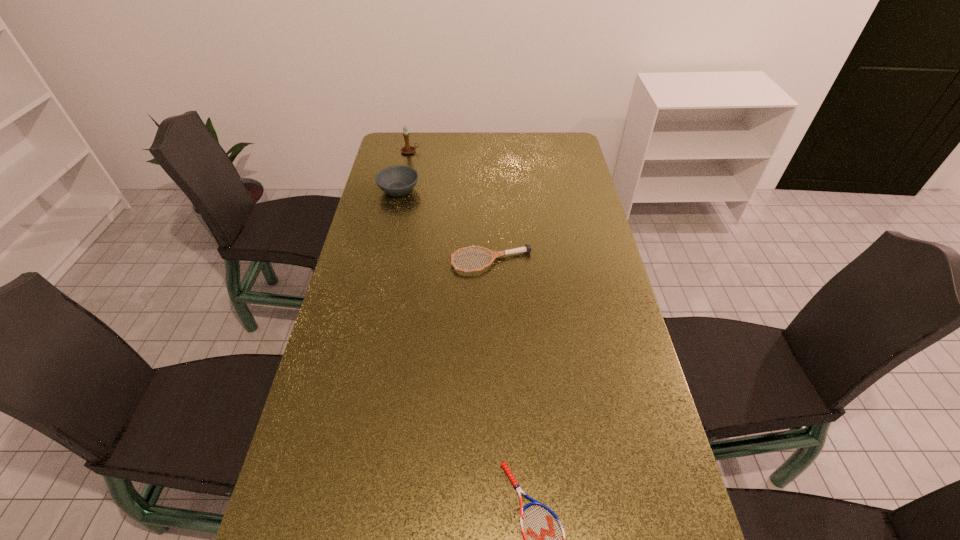
Find the location of a particular element. candle holder is located at coordinates (407, 149).

The height and width of the screenshot is (540, 960). In order to click on the tallest object in this screenshot , I will do `click(407, 149)`.

What are the coordinates of `soup bowl` in the screenshot? It's located at (398, 180).

Image resolution: width=960 pixels, height=540 pixels. Find the location of `the second farthest object`. the second farthest object is located at coordinates (398, 180).

I want to click on the second nearest object, so click(527, 248).

Identify the location of the third tallest object. (527, 248).

The width and height of the screenshot is (960, 540). I want to click on free location located 0.070m on the side of the farthest object with the handle, so click(436, 151).

The width and height of the screenshot is (960, 540). I want to click on free spot located 0.170m on the back of the second tallest object, so click(x=406, y=156).

Locate an element on the screen. The width and height of the screenshot is (960, 540). vacant space located on the front of the second shortest object is located at coordinates (492, 298).

The height and width of the screenshot is (540, 960). What are the coordinates of `object that is positioned at the far edge` in the screenshot? It's located at (407, 149).